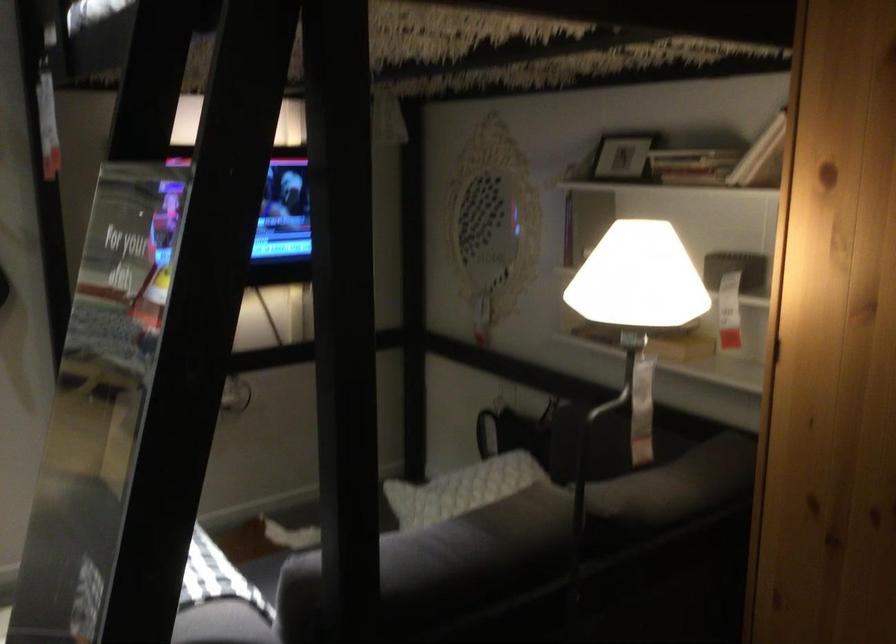
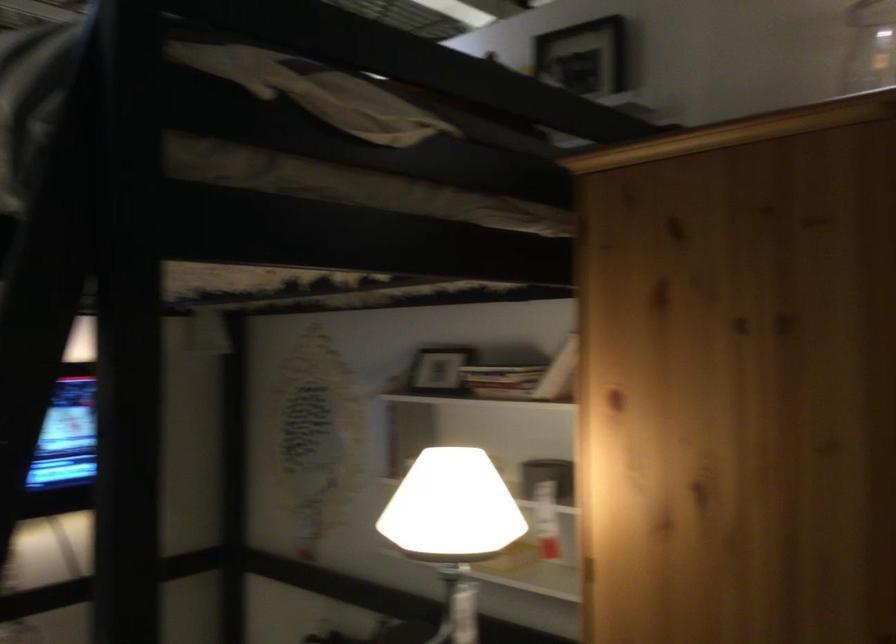
Question: How did the camera likely rotate?

Choices:
 (A) Left
 (B) Right
 (C) Up
 (D) Down

Answer: (C)